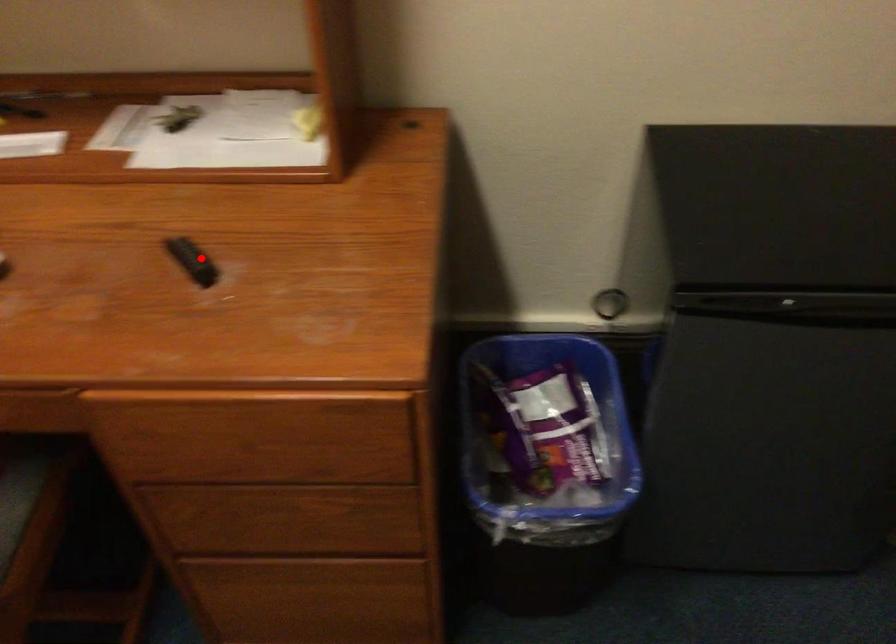
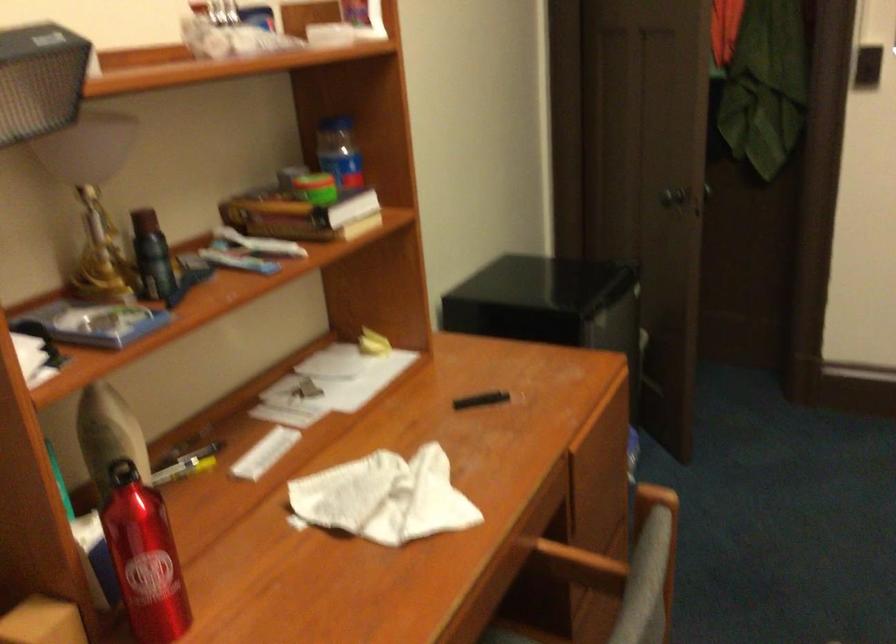
Question: I am providing you with two images of the same scene from different viewpoints. In image1, a red point is highlighted. Considering the same 3D point in image2, which of the following is correct?

Choices:
 (A) It is closer
 (B) It is farther

Answer: (B)